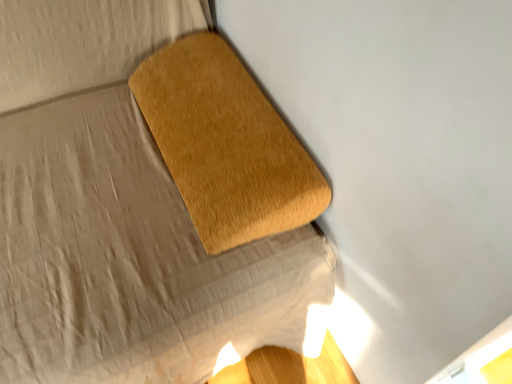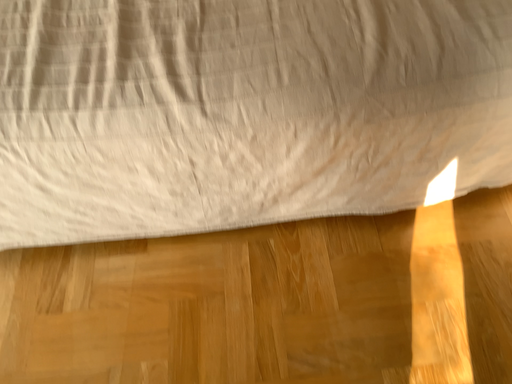
Question: How did the camera likely rotate when shooting the video?

Choices:
 (A) rotated left
 (B) rotated right

Answer: (A)